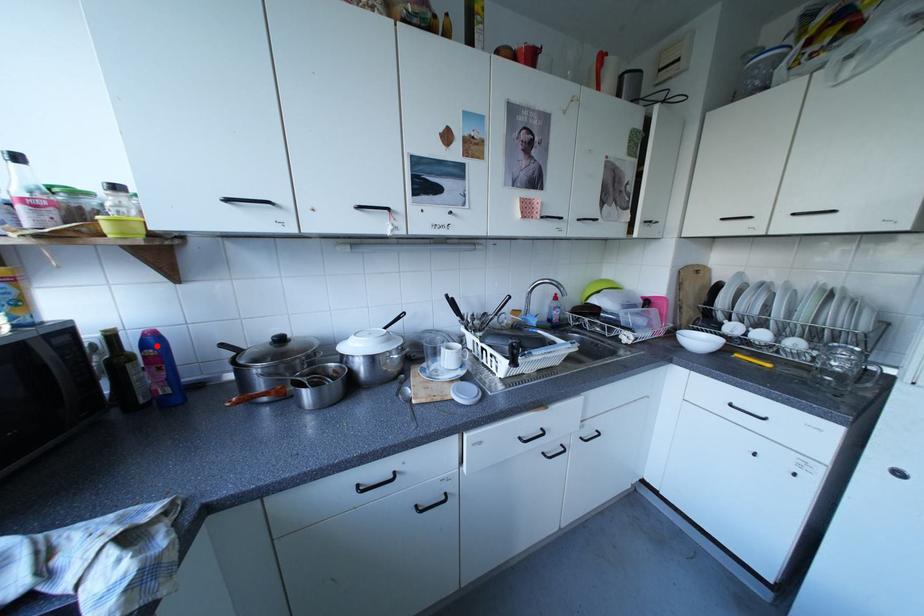
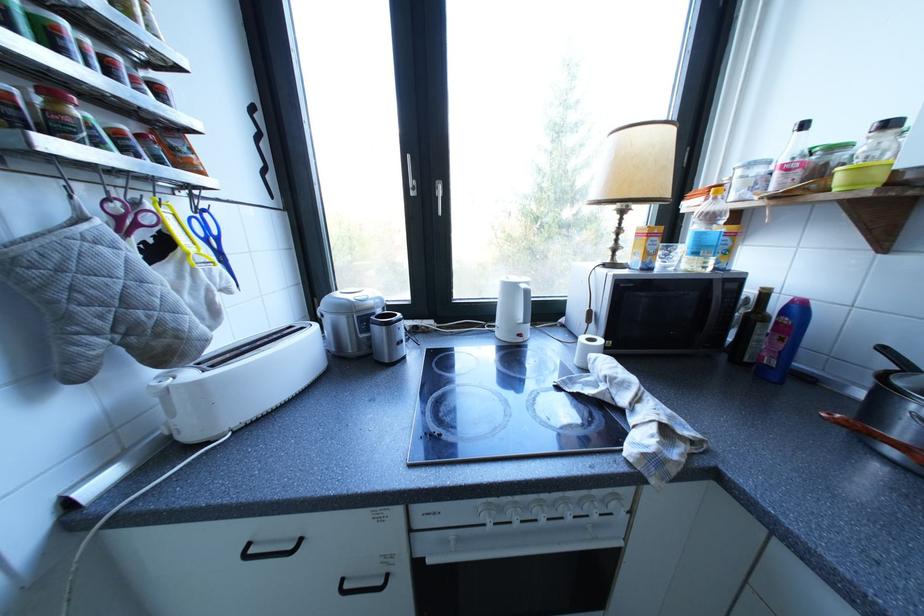
Locate, in the second image, the point that corresponds to the highlighted location in the first image.

(797, 312)